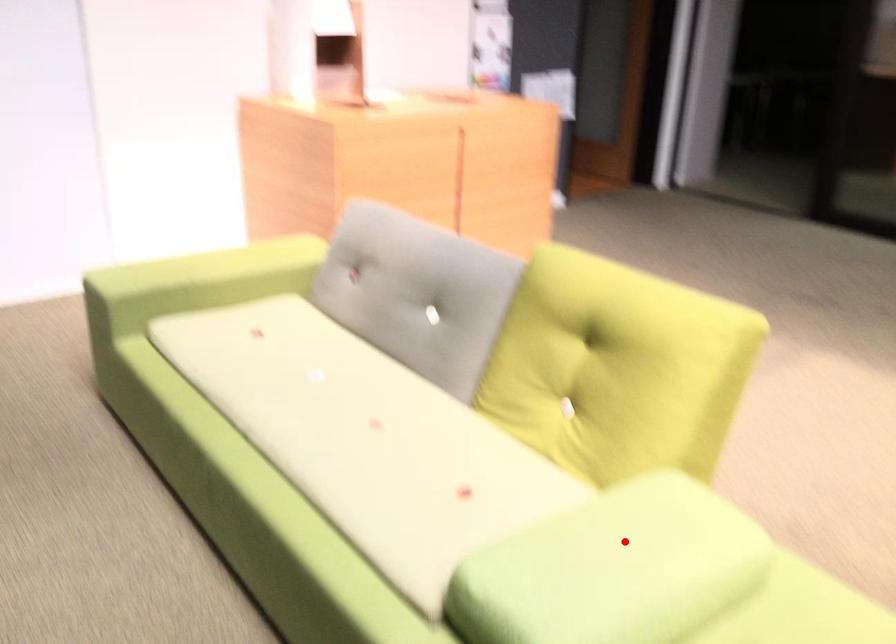
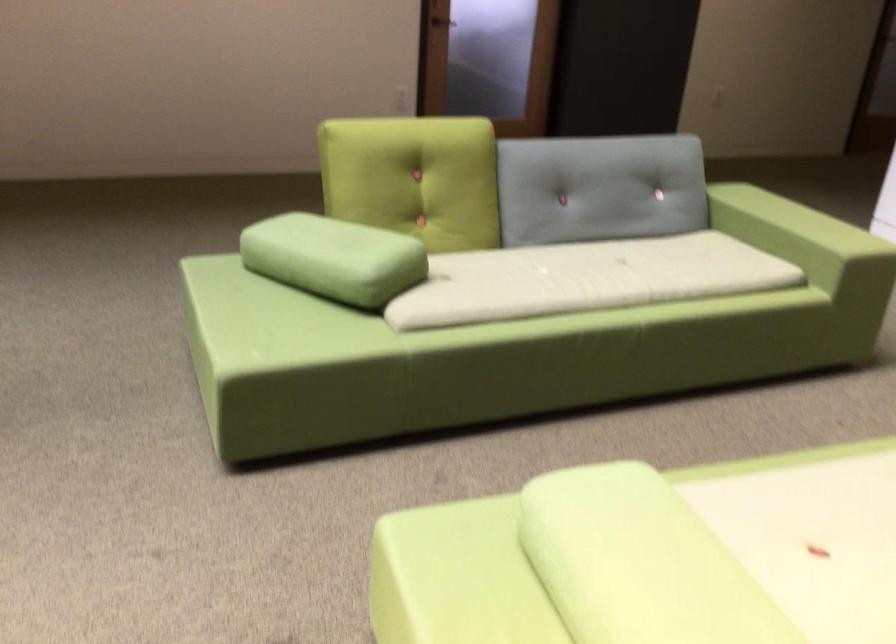
The point at the highlighted location is marked in the first image. Where is the corresponding point in the second image?

(651, 556)